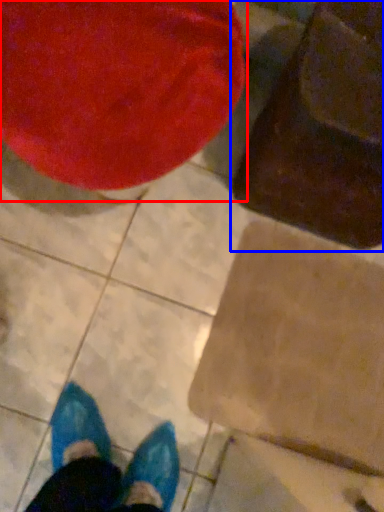
Question: Which of the following is the closest to the observer, bean bag chair (highlighted by a red box) or bean bag chair (highlighted by a blue box)?

Choices:
 (A) bean bag chair
 (B) bean bag chair

Answer: (A)